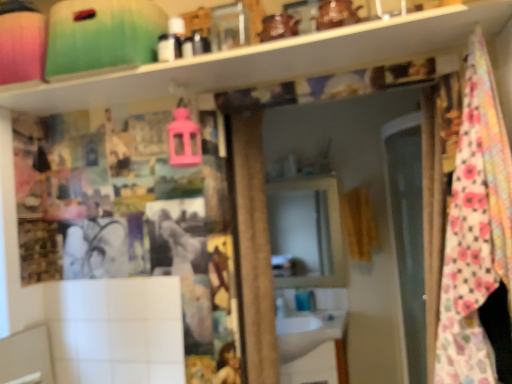
Question: Can you confirm if blue glossy faucet at lower center is smaller than white glossy sink at center?

Choices:
 (A) yes
 (B) no

Answer: (A)

Question: Is blue glossy faucet at lower center not inside white glossy sink at center?

Choices:
 (A) no
 (B) yes

Answer: (A)

Question: Does blue glossy faucet at lower center have a larger size compared to white glossy sink at center?

Choices:
 (A) yes
 (B) no

Answer: (B)

Question: Is white glossy sink at center a part of blue glossy faucet at lower center?

Choices:
 (A) yes
 (B) no

Answer: (B)

Question: Does blue glossy faucet at lower center lie in front of white glossy sink at center?

Choices:
 (A) yes
 (B) no

Answer: (B)

Question: In terms of size, does matte black toiletries at upper center appear bigger or smaller than floral cotton blanket at right?

Choices:
 (A) big
 (B) small

Answer: (B)

Question: In terms of height, does matte black toiletries at upper center look taller or shorter compared to floral cotton blanket at right?

Choices:
 (A) short
 (B) tall

Answer: (A)

Question: Considering their positions, is matte black toiletries at upper center located in front of or behind floral cotton blanket at right?

Choices:
 (A) behind
 (B) front

Answer: (A)

Question: From the image's perspective, relative to floral cotton blanket at right, is matte black toiletries at upper center above or below?

Choices:
 (A) below
 (B) above

Answer: (B)

Question: Does point (494, 120) appear closer or farther from the camera than point (309, 309)?

Choices:
 (A) closer
 (B) farther

Answer: (A)

Question: Considering the positions of floral cotton blanket at right and blue glossy faucet at lower center in the image, is floral cotton blanket at right bigger or smaller than blue glossy faucet at lower center?

Choices:
 (A) big
 (B) small

Answer: (A)

Question: Is floral cotton blanket at right to the left or to the right of blue glossy faucet at lower center in the image?

Choices:
 (A) right
 (B) left

Answer: (A)

Question: Do you think floral cotton blanket at right is within blue glossy faucet at lower center, or outside of it?

Choices:
 (A) outside
 (B) inside

Answer: (A)

Question: Considering the relative positions of matte black toiletries at upper center and white glossy sink at center in the image provided, is matte black toiletries at upper center to the left or to the right of white glossy sink at center?

Choices:
 (A) left
 (B) right

Answer: (A)

Question: From their relative heights in the image, would you say matte black toiletries at upper center is taller or shorter than white glossy sink at center?

Choices:
 (A) tall
 (B) short

Answer: (B)